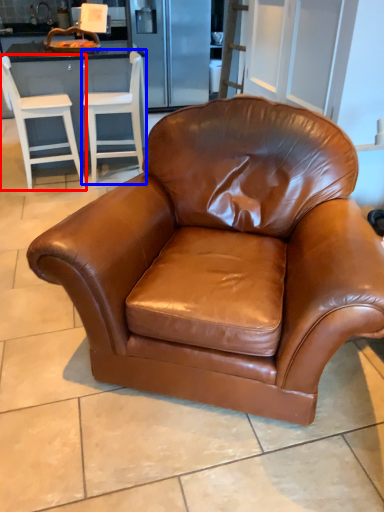
Question: Which object appears farthest to the camera in this image, chair (highlighted by a red box) or chair (highlighted by a blue box)?

Choices:
 (A) chair
 (B) chair

Answer: (B)